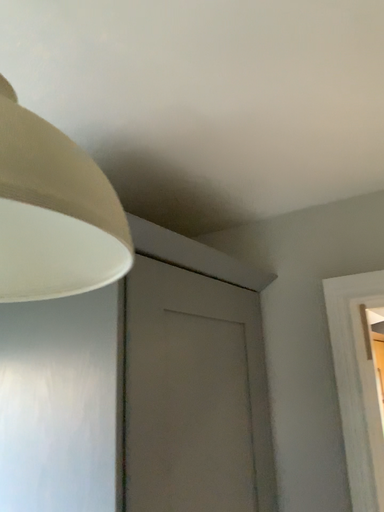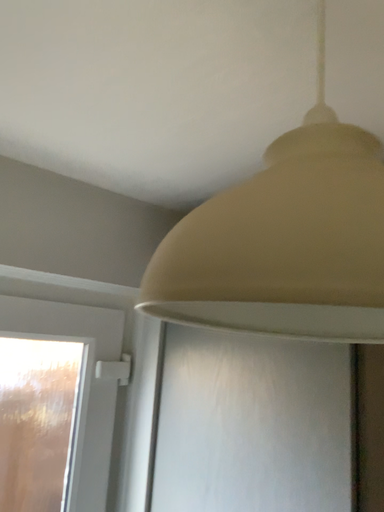
Question: How did the camera likely rotate when shooting the video?

Choices:
 (A) rotated left
 (B) rotated right

Answer: (A)